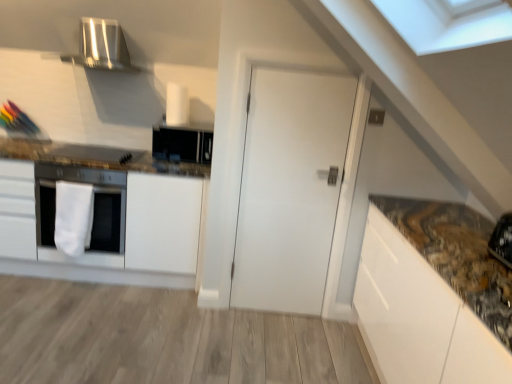
Question: Does white matte oven at left contain white matte door at center?

Choices:
 (A) yes
 (B) no

Answer: (B)

Question: Considering the relative sizes of white matte oven at left and white matte door at center in the image provided, is white matte oven at left shorter than white matte door at center?

Choices:
 (A) yes
 (B) no

Answer: (A)

Question: Is white matte oven at left at the left side of white matte door at center?

Choices:
 (A) no
 (B) yes

Answer: (B)

Question: Is white matte oven at left turned away from white matte door at center?

Choices:
 (A) yes
 (B) no

Answer: (B)

Question: Is white matte oven at left positioned beyond the bounds of white matte door at center?

Choices:
 (A) no
 (B) yes

Answer: (B)

Question: Would you say white matte cabinet at left is inside or outside white fabric towel at left?

Choices:
 (A) inside
 (B) outside

Answer: (B)

Question: From a real-world perspective, is white matte cabinet at left positioned above or below white fabric towel at left?

Choices:
 (A) below
 (B) above

Answer: (A)

Question: In the image, is white matte cabinet at left on the left side or the right side of white fabric towel at left?

Choices:
 (A) right
 (B) left

Answer: (B)

Question: From the image's perspective, is white matte cabinet at left positioned above or below white fabric towel at left?

Choices:
 (A) below
 (B) above

Answer: (B)

Question: From their relative heights in the image, would you say white fabric towel at left is taller or shorter than black matte microwave at upper center?

Choices:
 (A) tall
 (B) short

Answer: (A)

Question: From a real-world perspective, is white fabric towel at left above or below black matte microwave at upper center?

Choices:
 (A) above
 (B) below

Answer: (B)

Question: From the image's perspective, is white fabric towel at left above or below black matte microwave at upper center?

Choices:
 (A) above
 (B) below

Answer: (B)

Question: Is point (75, 241) positioned closer to the camera than point (173, 147)?

Choices:
 (A) closer
 (B) farther

Answer: (A)

Question: Does point tap(64, 213) appear closer or farther from the camera than point tap(151, 165)?

Choices:
 (A) farther
 (B) closer

Answer: (B)

Question: Is white fabric towel at left spatially inside white matte cabinet at left, or outside of it?

Choices:
 (A) outside
 (B) inside

Answer: (A)